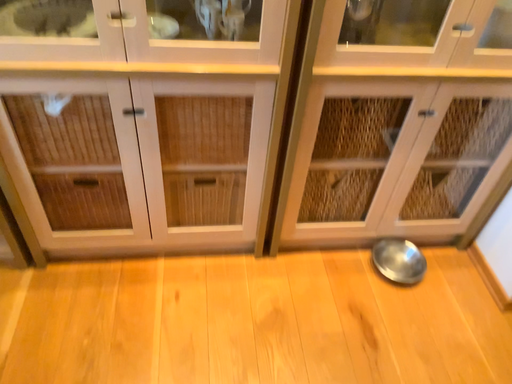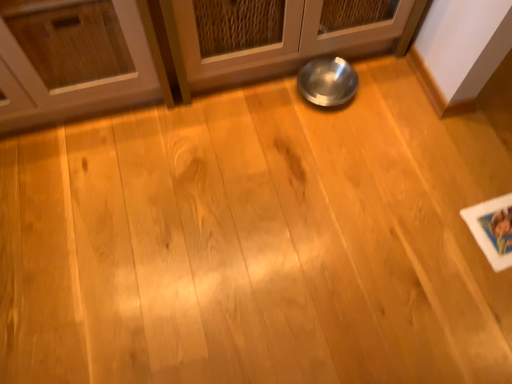
Question: Which way did the camera rotate in the video?

Choices:
 (A) rotated upward
 (B) rotated downward

Answer: (B)